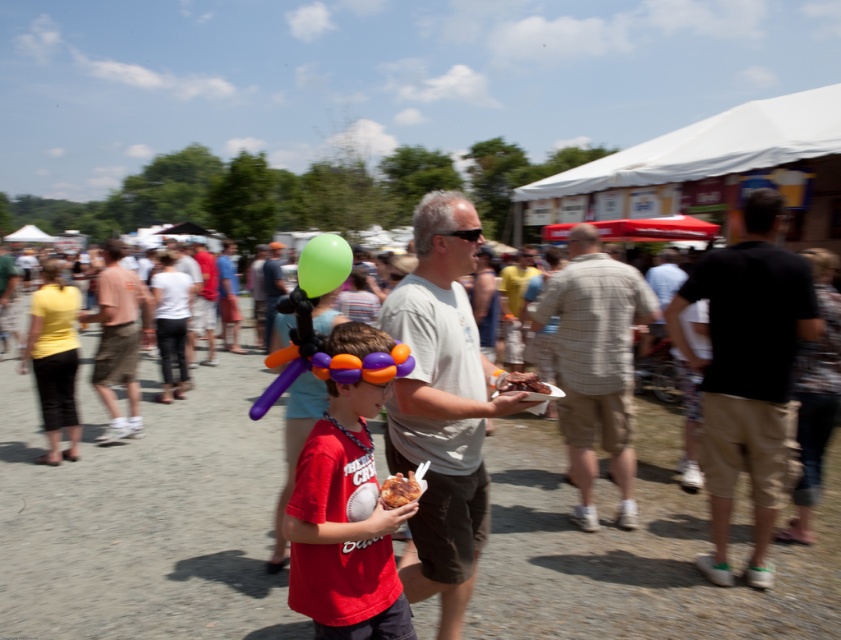
Question: Estimate the real-world distances between objects in this image. Which object is farther from the red cotton shirt at center?

Choices:
 (A) golden crispy chicken at center
 (B) brown crispy meat at center
 (C) light brown shirt at center
 (D) plaid shirt at center

Answer: (C)

Question: In this image, where is gray cotton shirt at center located relative to plaid shirt at center?

Choices:
 (A) above
 (B) below

Answer: (B)

Question: Estimate the real-world distances between objects in this image. Which object is farther from the matte khaki shorts at left?

Choices:
 (A) red cotton shirt at center
 (B) matte gray shirt at center
 (C) plaid shirt at center
 (D) golden crispy chicken at center

Answer: (D)

Question: Can you confirm if light brown shirt at center is positioned to the left of brown crispy meat at center?

Choices:
 (A) no
 (B) yes

Answer: (B)

Question: Estimate the real-world distances between objects in this image. Which object is farther from the matte gray shirt at center?

Choices:
 (A) red cotton shirt at center
 (B) light brown shirt at center
 (C) black cotton shirt at right
 (D) matte khaki shorts at left

Answer: (A)

Question: Is light brown shirt at center thinner than brown crispy meat at center?

Choices:
 (A) no
 (B) yes

Answer: (A)